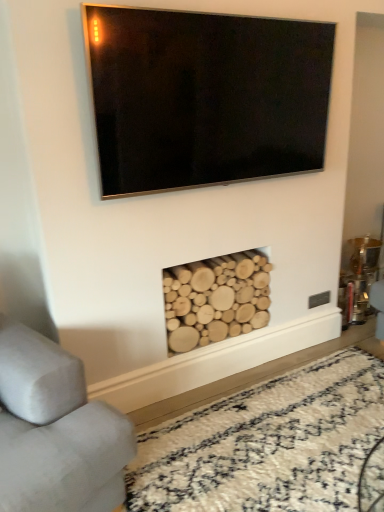
Question: Should I look upward or downward to see natural wood logs at lower center?

Choices:
 (A) up
 (B) down

Answer: (B)

Question: Is matte black tv at upper center at the back of natural wood logs at lower center?

Choices:
 (A) yes
 (B) no

Answer: (B)

Question: Is natural wood logs at lower center facing towards matte black tv at upper center?

Choices:
 (A) yes
 (B) no

Answer: (B)

Question: Considering the relative positions of natural wood logs at lower center and matte black tv at upper center in the image provided, is natural wood logs at lower center to the right of matte black tv at upper center from the viewer's perspective?

Choices:
 (A) no
 (B) yes

Answer: (A)

Question: Is natural wood logs at lower center touching matte black tv at upper center?

Choices:
 (A) no
 (B) yes

Answer: (A)

Question: Considering the relative positions of natural wood logs at lower center and matte black tv at upper center in the image provided, is natural wood logs at lower center in front of matte black tv at upper center?

Choices:
 (A) yes
 (B) no

Answer: (B)

Question: Does natural wood logs at lower center have a lesser width compared to matte black tv at upper center?

Choices:
 (A) yes
 (B) no

Answer: (B)

Question: Can you confirm if matte black tv at upper center is smaller than gray fabric couch at lower left?

Choices:
 (A) yes
 (B) no

Answer: (A)

Question: Is matte black tv at upper center at the right side of gray fabric couch at lower left?

Choices:
 (A) no
 (B) yes

Answer: (B)

Question: Considering the relative positions of matte black tv at upper center and gray fabric couch at lower left in the image provided, is matte black tv at upper center to the left of gray fabric couch at lower left from the viewer's perspective?

Choices:
 (A) no
 (B) yes

Answer: (A)

Question: Are matte black tv at upper center and gray fabric couch at lower left located far from each other?

Choices:
 (A) no
 (B) yes

Answer: (B)

Question: From a real-world perspective, is matte black tv at upper center over gray fabric couch at lower left?

Choices:
 (A) yes
 (B) no

Answer: (A)

Question: From the image's perspective, is matte black tv at upper center located beneath gray fabric couch at lower left?

Choices:
 (A) yes
 (B) no

Answer: (B)

Question: Does natural wood logs at lower center lie in front of natural wood logs at lower center?

Choices:
 (A) yes
 (B) no

Answer: (A)